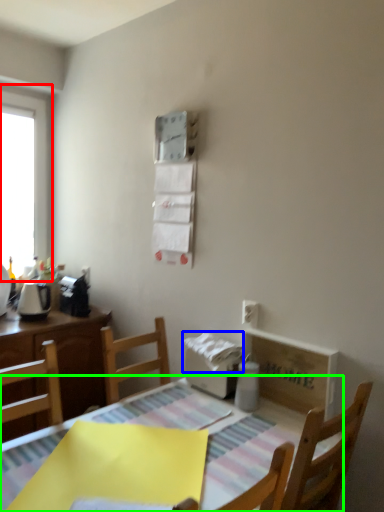
Question: Estimate the real-world distances between objects in this image. Which object is closer to window (highlighted by a red box), toilet paper (highlighted by a blue box) or table (highlighted by a green box)?

Choices:
 (A) toilet paper
 (B) table

Answer: (A)